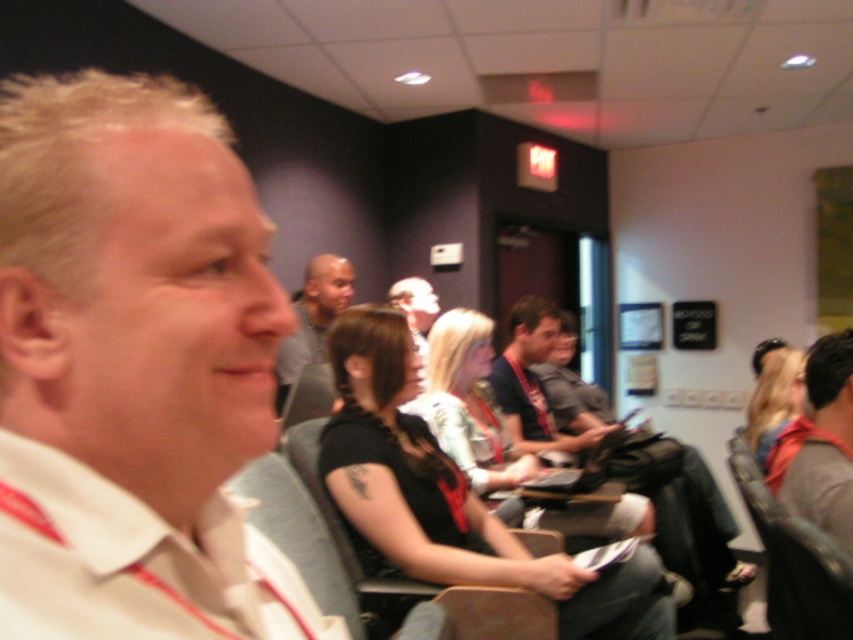
Question: Which object appears farthest from the camera in this image?

Choices:
 (A) white cotton shirt at left
 (B) black leather chair at lower right
 (C) gray fabric chair at center

Answer: (C)

Question: Which object is farther from the camera taking this photo?

Choices:
 (A) gray fabric chair at center
 (B) black leather chair at lower right
 (C) gray fabric shirt at center
 (D) dark blue t-shirt at center

Answer: (D)

Question: Is dark blue t-shirt at center below gray fabric chair at center?

Choices:
 (A) yes
 (B) no

Answer: (B)

Question: Is dark blue t-shirt at center further to the viewer compared to black leather chair at lower right?

Choices:
 (A) no
 (B) yes

Answer: (B)

Question: Is white cotton shirt at left further to the viewer compared to gray fabric shirt at center?

Choices:
 (A) yes
 (B) no

Answer: (B)

Question: Which object is positioned farthest from the dark blue t-shirt at center?

Choices:
 (A) black leather chair at lower right
 (B) gray fabric shirt at center
 (C) gray fabric chair at center

Answer: (C)